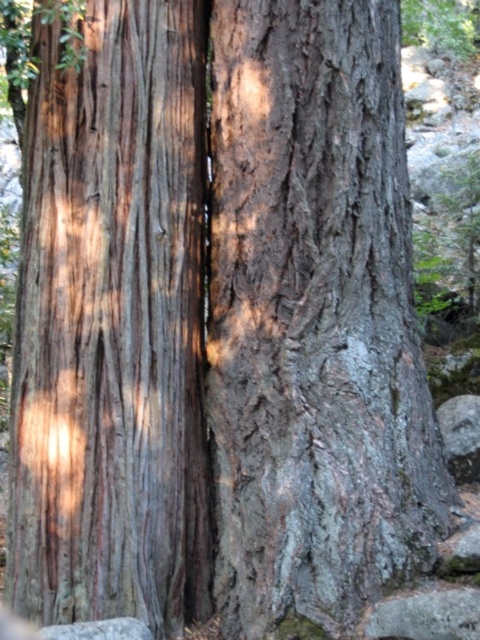
Looking at this image, can you confirm if smooth brown bark at center is taller than gray rough stone at lower left?

Indeed, smooth brown bark at center has a greater height compared to gray rough stone at lower left.

Can you confirm if smooth brown bark at center is shorter than gray rough stone at lower left?

No.

Is point (48, 492) positioned before point (75, 625)?

No.

You are a GUI agent. You are given a task and a screenshot of the screen. Output one action in this format:
    pyautogui.click(x=<x>, y=<y>)
    Task: Click on the smooth brown bark at center
    
    Given the screenshot: What is the action you would take?
    pyautogui.click(x=112, y=326)